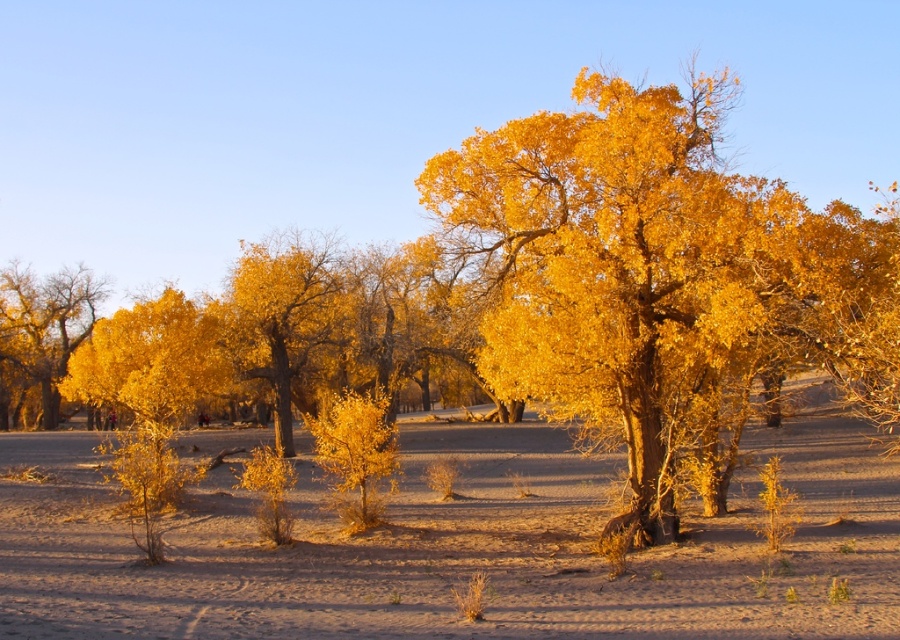
Based on the photo, you are an environmental scientist studying tree growth in desert environments. You observe two trees in the scene, the golden textured tree at center and the golden matte tree at center. Which tree is taller?

The golden textured tree at center is taller than the golden matte tree at center according to the description.

You are standing in the middle of the desert and see two golden trees ahead of you. Which one is positioned to the right of the other? The trees are labeled as golden textured tree at center and golden matte tree at center. Please specify which one is on the right side.

The golden textured tree at center is positioned to the right of the golden matte tree at center.